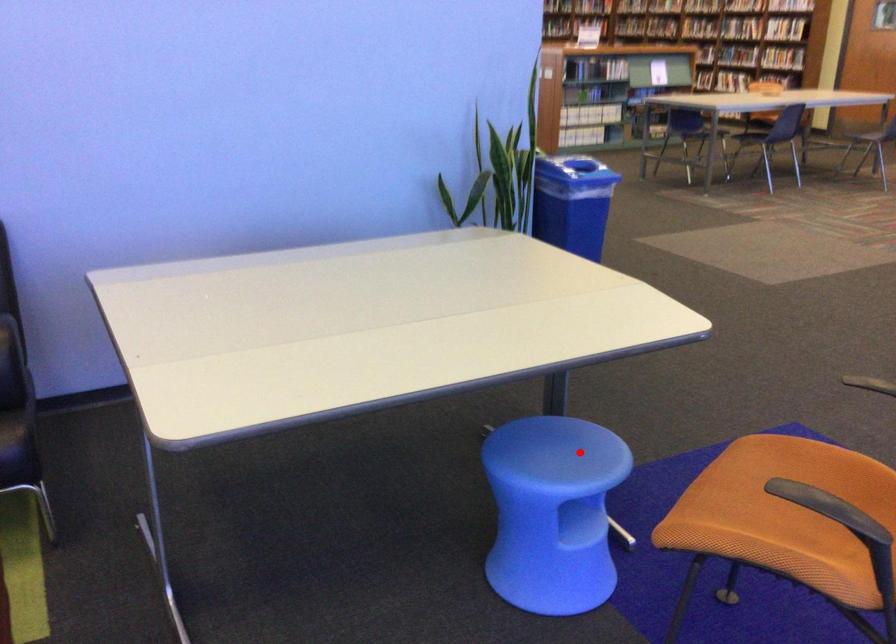
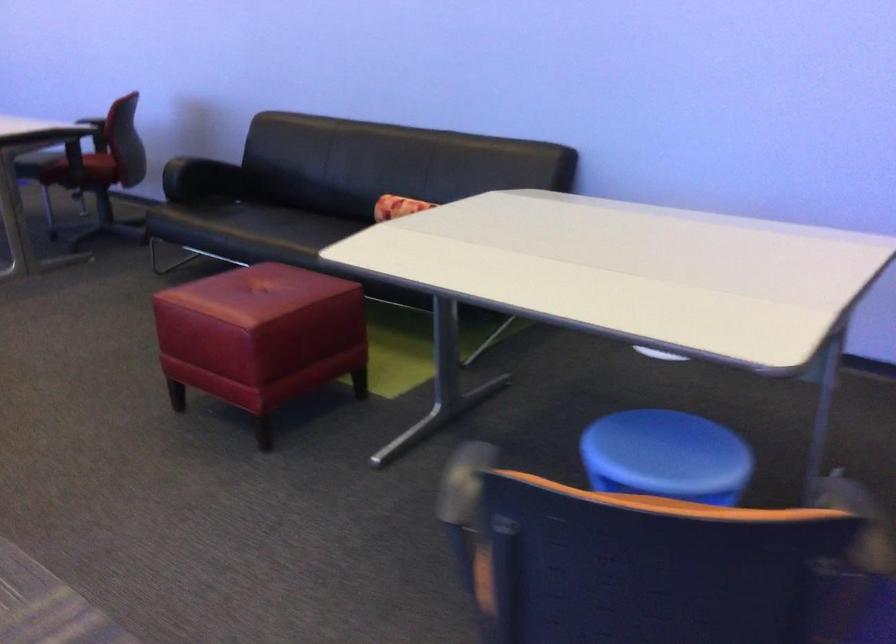
Where in the second image is the point corresponding to the highlighted location from the first image?

(666, 456)